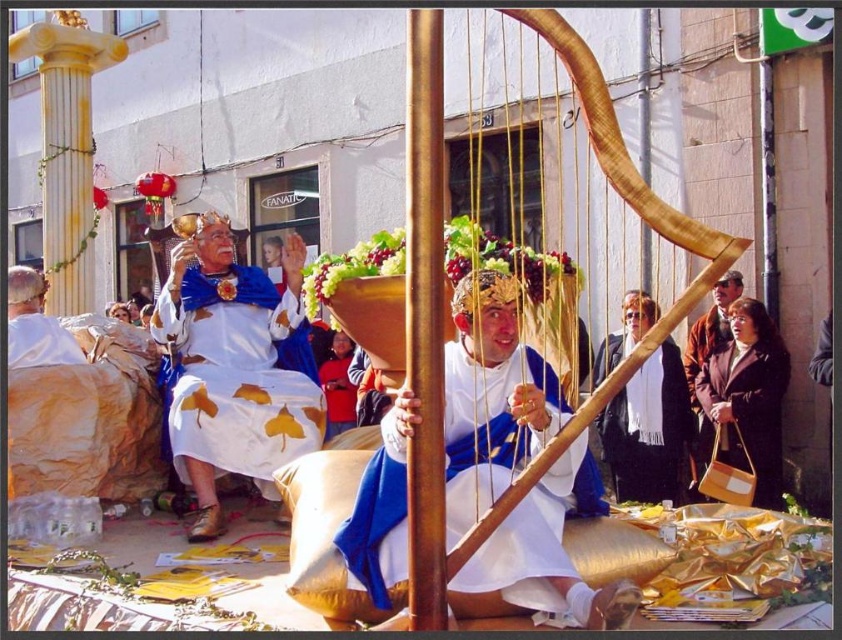
Is white scarf at center to the left of matte gold crown at center from the viewer's perspective?

Incorrect, white scarf at center is not on the left side of matte gold crown at center.

Can you confirm if white scarf at center is wider than matte gold crown at center?

Yes, white scarf at center is wider than matte gold crown at center.

Locate an element on the screen. white scarf at center is located at coordinates (648, 429).

Identify the location of white scarf at center. The image size is (842, 640). (648, 429).

Who is lower down, brown leather handbag at lower right or matte gold crown at center?

matte gold crown at center is below.

Does brown leather handbag at lower right appear under matte gold crown at center?

No, brown leather handbag at lower right is not below matte gold crown at center.

Which is in front, point (763, 401) or point (340, 394)?

Point (763, 401) is in front.

You are a GUI agent. You are given a task and a screenshot of the screen. Output one action in this format:
    pyautogui.click(x=<x>, y=<y>)
    Task: Click on the brown leather handbag at lower right
    This screenshot has width=842, height=640.
    Given the screenshot: What is the action you would take?
    pyautogui.click(x=749, y=410)

Is point (531, 502) less distant than point (654, 310)?

That is True.

Between point (377, 484) and point (637, 397), which one is positioned behind?

The point (637, 397) is more distant.

Locate an element on the screen. white satin robe at center is located at coordinates (488, 429).